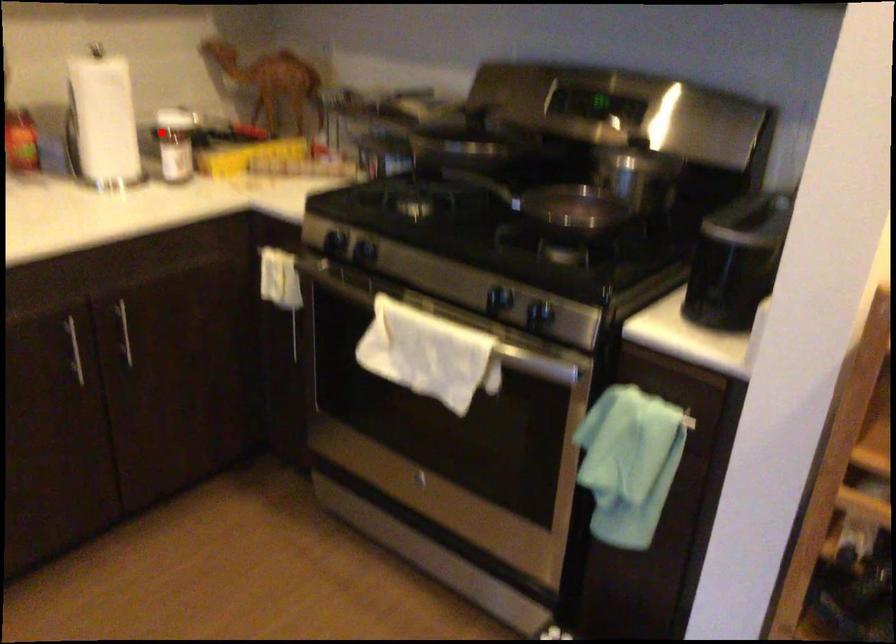
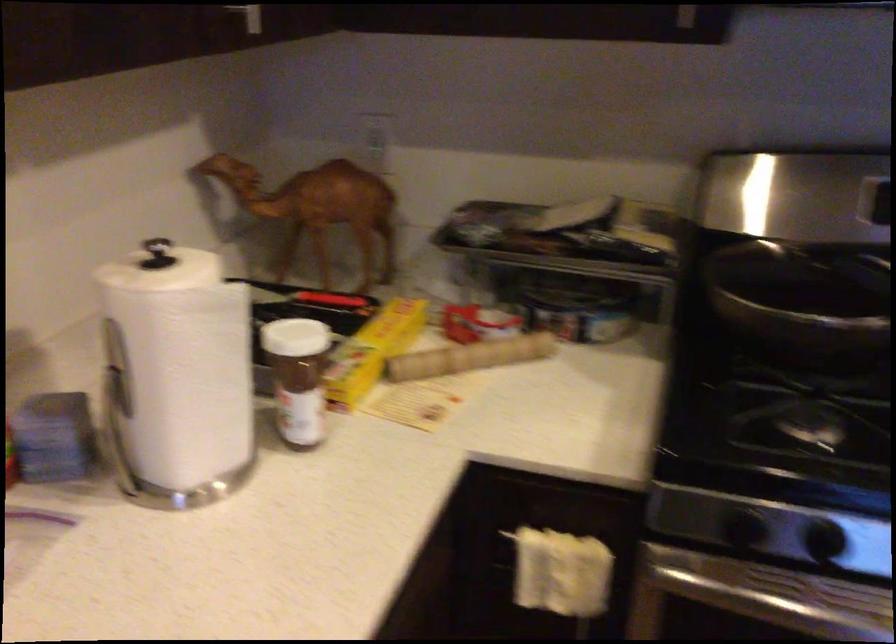
Where in the second image is the point corresponding to the highlighted location from the first image?

(297, 377)